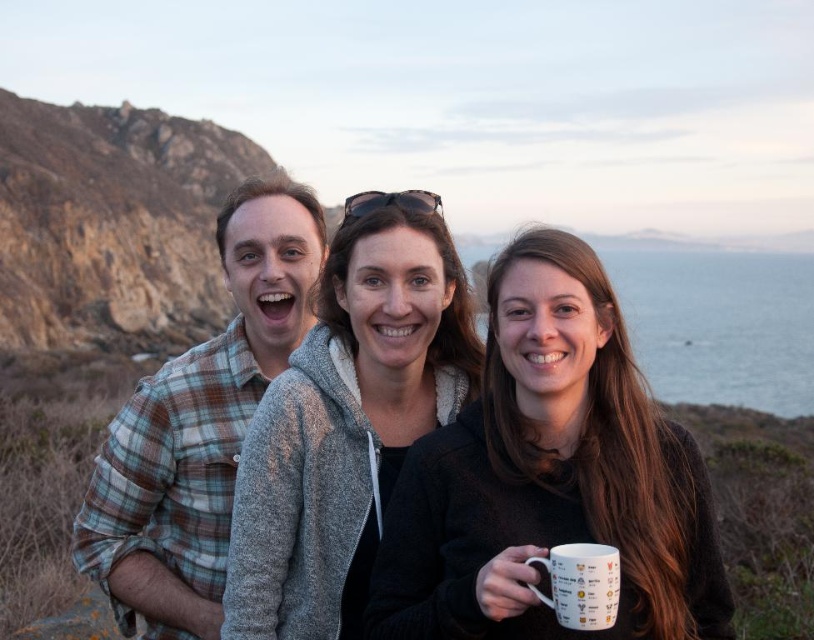
Consider the image. You are standing at the position of the plaid flannel shirt at left and want to throw a small ball to someone holding the white ceramic mug at lower right. Considering the distance between them, is it feasible to make the throw without the ball dropping into the water behind the mug?

→ The plaid flannel shirt at left is 15.52 meters away from the white ceramic mug at lower right. Since the distance is quite far, the ball might drop into the water behind the mug unless thrown accurately. It is possible but requires a strong and precise throw.

You are a photographer positioned at point (550,476) and want to capture the white glossy mug at center. Which direction should you move to get a better view of the rugged cliffs in the background?

Move away from the white glossy mug at center towards the background to get a better view of the rugged cliffs.